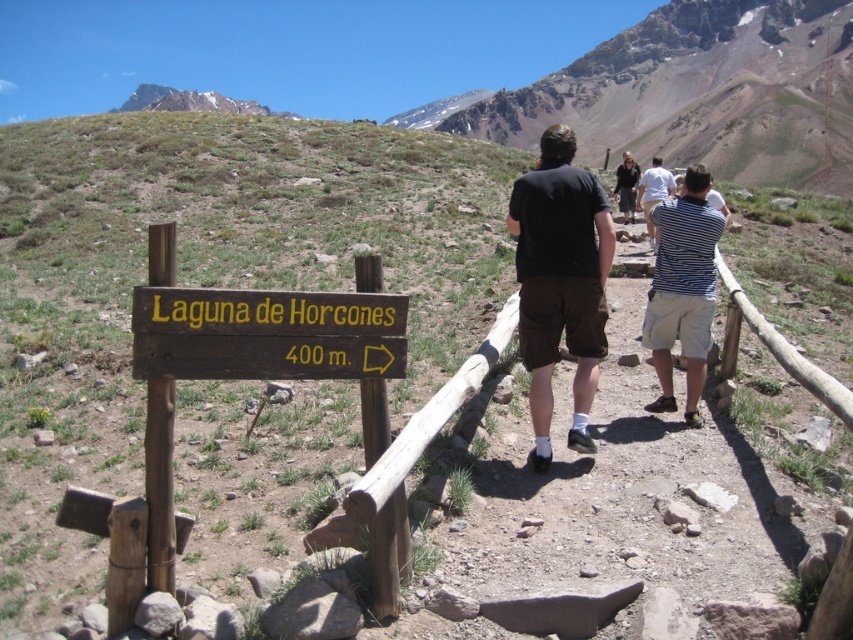
Which is below, brown wooden sign at lower left or black cotton shirt at center?

brown wooden sign at lower left is lower down.

Where is `brown wooden sign at lower left`? brown wooden sign at lower left is located at coordinates (265, 333).

What do you see at coordinates (265, 333) in the screenshot? I see `brown wooden sign at lower left` at bounding box center [265, 333].

Locate an element on the screen. brown wooden sign at lower left is located at coordinates (265, 333).

Is rugged brown rock formation at upper center shorter than white snow-covered mountain at upper center?

In fact, rugged brown rock formation at upper center may be taller than white snow-covered mountain at upper center.

Between rugged brown rock formation at upper center and white snow-covered mountain at upper center, which one is positioned lower?

rugged brown rock formation at upper center is below.

Does point (556, 93) lie behind point (163, 102)?

No.

Identify the location of rugged brown rock formation at upper center. The height and width of the screenshot is (640, 853). (693, 93).

In the scene shown: Is rugged brown rock formation at upper center bigger than brown wooden sign at lower left?

Indeed, rugged brown rock formation at upper center has a larger size compared to brown wooden sign at lower left.

Is point (695, 150) positioned before point (312, 353)?

That is False.

Between point (659, 65) and point (331, 358), which one is positioned in front?

Point (331, 358) is more forward.

This screenshot has height=640, width=853. I want to click on rugged brown rock formation at upper center, so pos(693,93).